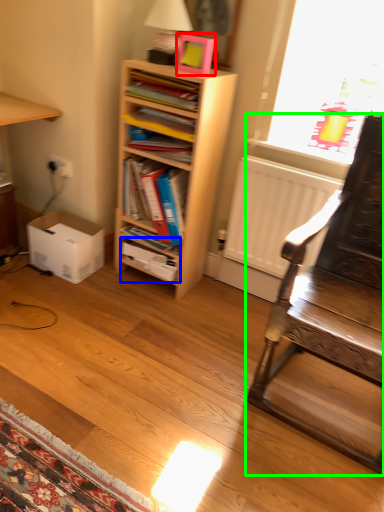
Question: Considering the real-world distances, which object is farthest from picture frame (highlighted by a red box)? book (highlighted by a blue box) or chair (highlighted by a green box)?

Choices:
 (A) book
 (B) chair

Answer: (B)